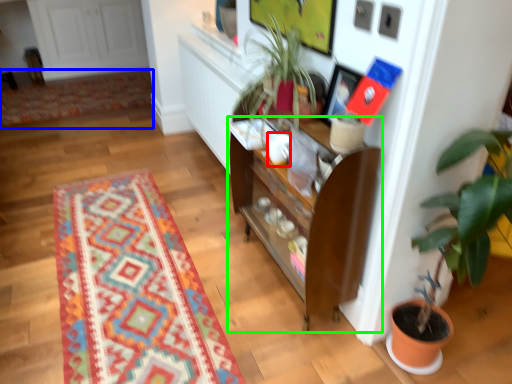
Question: Which is farther away from coffee cup (highlighted by a red box)? mat (highlighted by a blue box) or cabinetry (highlighted by a green box)?

Choices:
 (A) mat
 (B) cabinetry

Answer: (A)